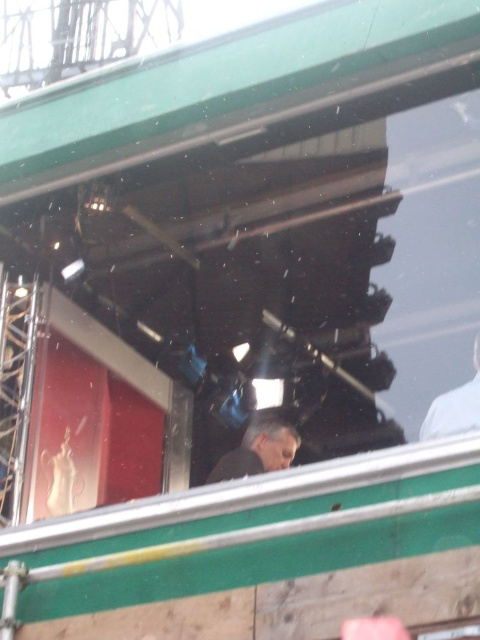
Question: Is gray matte jacket at center bigger than white matte shirt at upper right?

Choices:
 (A) no
 (B) yes

Answer: (A)

Question: In this image, where is gray matte jacket at center located relative to white matte shirt at upper right?

Choices:
 (A) below
 (B) above

Answer: (A)

Question: Which point appears farthest from the camera in this image?

Choices:
 (A) (230, 474)
 (B) (447, 412)

Answer: (A)

Question: Observing the image, what is the correct spatial positioning of gray matte jacket at center in reference to white matte shirt at upper right?

Choices:
 (A) above
 (B) below

Answer: (B)